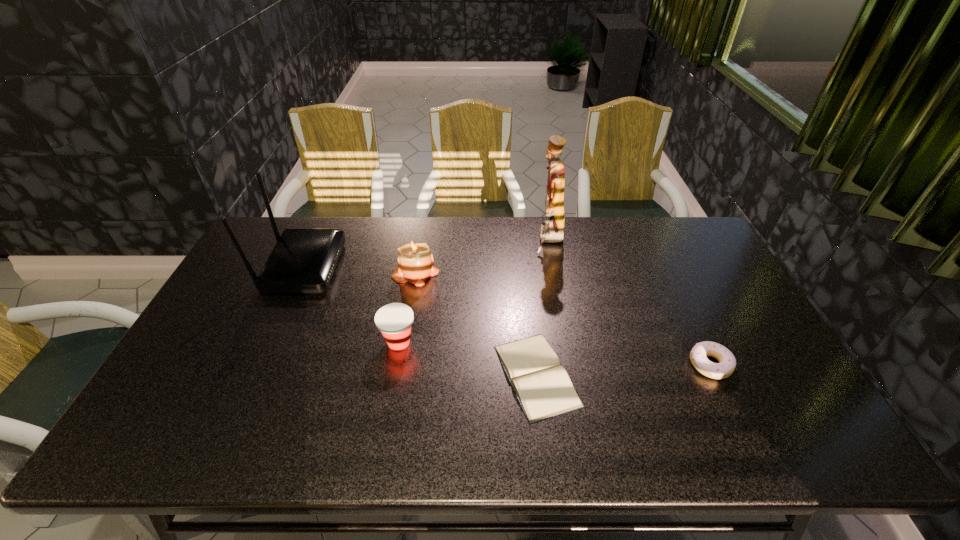
Image resolution: width=960 pixels, height=540 pixels. Find the location of `the tallest object`. the tallest object is located at coordinates (551, 231).

Image resolution: width=960 pixels, height=540 pixels. What are the coordinates of `the second tallest object` in the screenshot? It's located at (303, 260).

This screenshot has width=960, height=540. I want to click on router, so click(x=303, y=260).

The width and height of the screenshot is (960, 540). In order to click on candle in this screenshot , I will do `click(415, 260)`.

Find the location of a particular element. Dixie cup is located at coordinates (394, 320).

Where is `doughnut`? This screenshot has height=540, width=960. doughnut is located at coordinates (727, 363).

Identify the location of the second shortest object. (727, 363).

Locate an element on the screen. The image size is (960, 540). Bible is located at coordinates (x=542, y=386).

Find the location of a particular element. vacant space located on the front-facing side of the tallest object is located at coordinates (433, 241).

I want to click on blank space located on the front-facing side of the tallest object, so (484, 241).